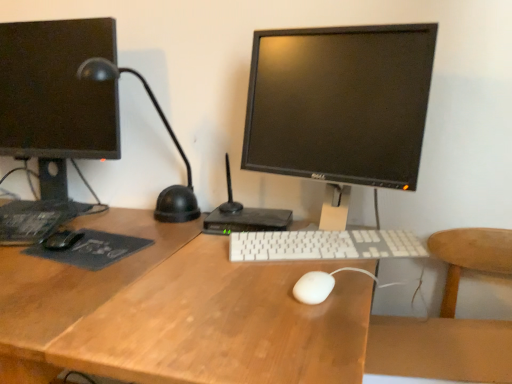
Locate an element on the screen. Image resolution: width=512 pixels, height=384 pixels. free space between black matte desk lamp at left and white matte mouse at center, placed as the first mouse when sorted from right to left is located at coordinates (214, 251).